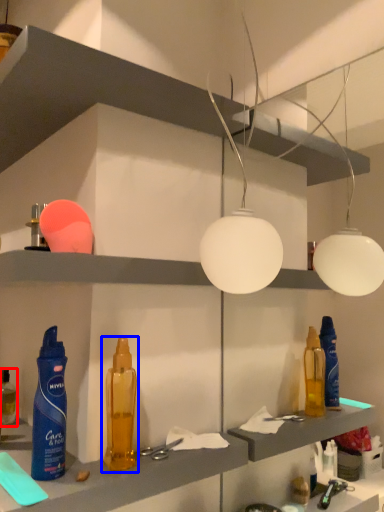
Question: Which object appears closest to the camera in this image, bottle (highlighted by a red box) or bottle (highlighted by a blue box)?

Choices:
 (A) bottle
 (B) bottle

Answer: (B)